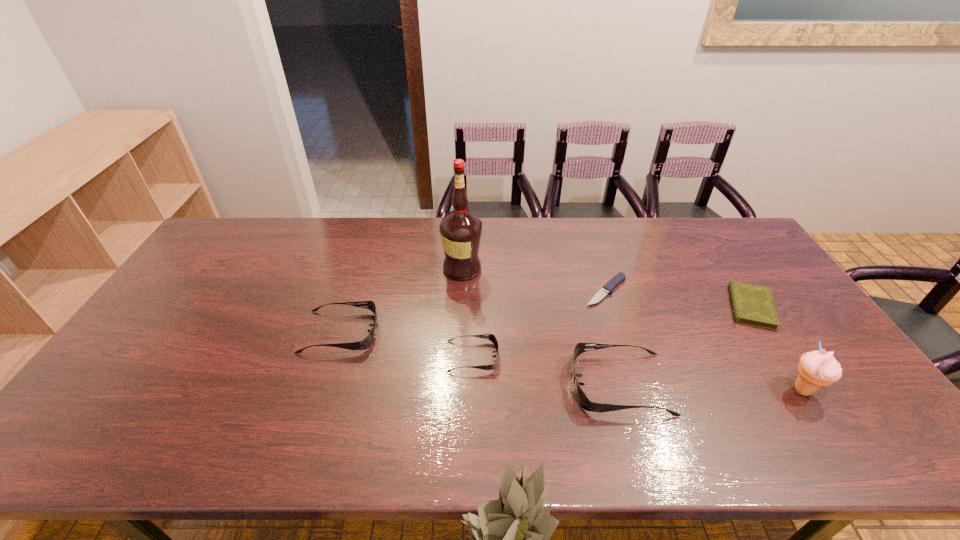
Locate which object ranks fourth in proximity to the second sunglasses from left to right. Please provide its 2D coordinates. Your answer should be formatted as a tuple, i.e. [(x, y)], where the tuple contains the x and y coordinates of a point satisfying the conditions above.

[(620, 277)]

Select which object is the third closest to the steak knife. Please provide its 2D coordinates. Your answer should be formatted as a tuple, i.e. [(x, y)], where the tuple contains the x and y coordinates of a point satisfying the conditions above.

[(491, 337)]

Identify which sunglasses is located as the third nearest to the diary. Please provide its 2D coordinates. Your answer should be formatted as a tuple, i.e. [(x, y)], where the tuple contains the x and y coordinates of a point satisfying the conditions above.

[(367, 341)]

Select which sunglasses appears as the second closest to the rightmost sunglasses. Please provide its 2D coordinates. Your answer should be formatted as a tuple, i.e. [(x, y)], where the tuple contains the x and y coordinates of a point satisfying the conditions above.

[(367, 341)]

You are a GUI agent. You are given a task and a screenshot of the screen. Output one action in this format:
    pyautogui.click(x=<x>, y=<y>)
    Task: Click on the free spot that satisfies the following two spatial constraints: 1. on the label of the alcohol; 2. on the back side of the sixth tallest object
    The width and height of the screenshot is (960, 540).
    Given the screenshot: What is the action you would take?
    pyautogui.click(x=461, y=307)

In order to click on vacant space that satisfies the following two spatial constraints: 1. on the front side of the diary; 2. on the front-facing side of the rightmost sunglasses in this screenshot , I will do `click(802, 384)`.

Image resolution: width=960 pixels, height=540 pixels. I want to click on free space in the image that satisfies the following two spatial constraints: 1. on the front side of the shortest object; 2. on the front-facing side of the second sunglasses from right to left, so click(626, 356).

The width and height of the screenshot is (960, 540). Find the location of `free space that satisfies the following two spatial constraints: 1. on the front-facing side of the sixth shortest object; 2. on the right side of the rightmost sunglasses`. free space that satisfies the following two spatial constraints: 1. on the front-facing side of the sixth shortest object; 2. on the right side of the rightmost sunglasses is located at coordinates (621, 390).

Image resolution: width=960 pixels, height=540 pixels. Find the location of `free space that satisfies the following two spatial constraints: 1. on the back side of the diary; 2. on the label of the alcohol`. free space that satisfies the following two spatial constraints: 1. on the back side of the diary; 2. on the label of the alcohol is located at coordinates (727, 269).